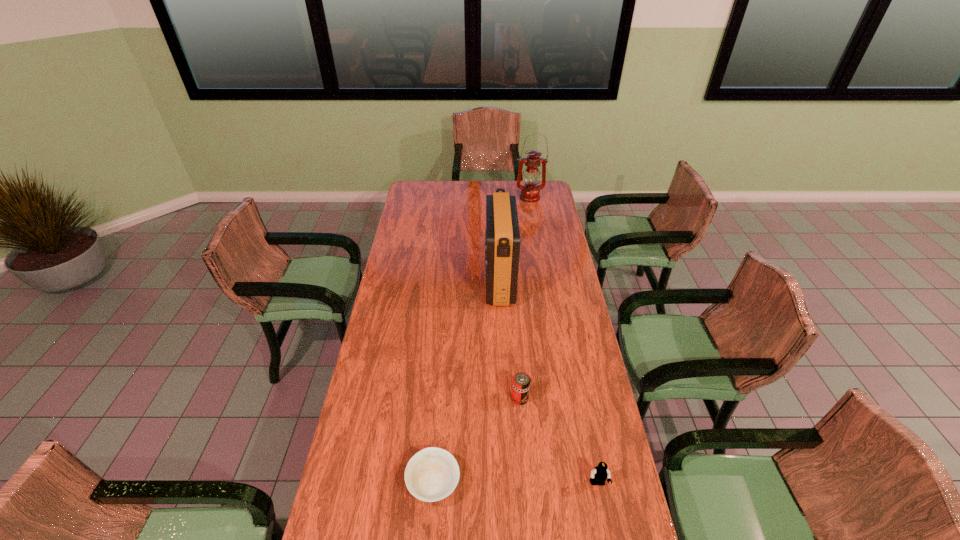
The width and height of the screenshot is (960, 540). What are the coordinates of `free space located 0.390m on the back of the can` in the screenshot? It's located at [514, 312].

Where is `vacant area situated 0.110m on the front-facing side of the Lego`? The width and height of the screenshot is (960, 540). vacant area situated 0.110m on the front-facing side of the Lego is located at coordinates (607, 530).

Image resolution: width=960 pixels, height=540 pixels. In order to click on vacant region located on the right of the bowl in this screenshot , I will do `click(567, 483)`.

Where is `object that is at the far edge`? object that is at the far edge is located at coordinates (530, 192).

Find the location of a particular element. The image size is (960, 540). oil lamp that is at the right edge is located at coordinates pyautogui.click(x=530, y=192).

Locate an element on the screen. The image size is (960, 540). Lego that is at the right edge is located at coordinates (600, 473).

Where is `object located at the far right corner`? This screenshot has height=540, width=960. object located at the far right corner is located at coordinates (530, 192).

Locate an element on the screen. The width and height of the screenshot is (960, 540). vacant region at the far edge of the desktop is located at coordinates (522, 184).

Locate an element on the screen. The height and width of the screenshot is (540, 960). free region at the left edge of the desktop is located at coordinates (402, 307).

In the image, there is a desktop. Where is `vacant area at the right edge`? The height and width of the screenshot is (540, 960). vacant area at the right edge is located at coordinates (552, 261).